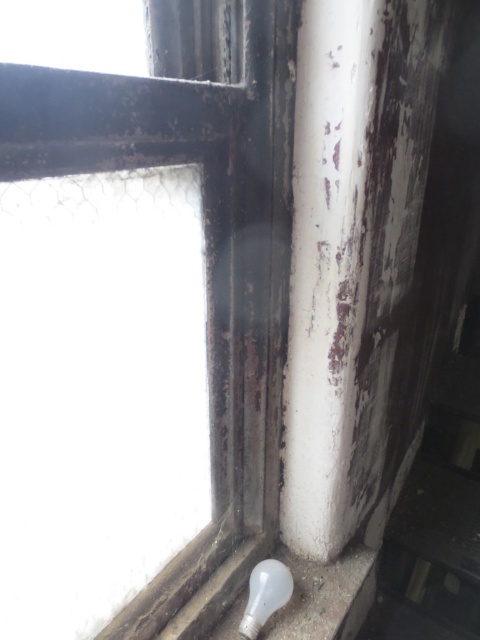
Question: In this image, where is rusty metal window frame at lower right located relative to translucent glass bulb at lower right?

Choices:
 (A) left
 (B) right

Answer: (A)

Question: Which object is farther from the camera taking this photo?

Choices:
 (A) rusty metal window frame at lower right
 (B) translucent glass bulb at lower right

Answer: (B)

Question: Can you confirm if rusty metal window frame at lower right is positioned to the left of translucent glass bulb at lower right?

Choices:
 (A) no
 (B) yes

Answer: (B)

Question: Considering the relative positions of rusty metal window frame at lower right and translucent glass bulb at lower right in the image provided, where is rusty metal window frame at lower right located with respect to translucent glass bulb at lower right?

Choices:
 (A) right
 (B) left

Answer: (B)

Question: Among these points, which one is nearest to the camera?

Choices:
 (A) (249, 612)
 (B) (272, 362)

Answer: (B)